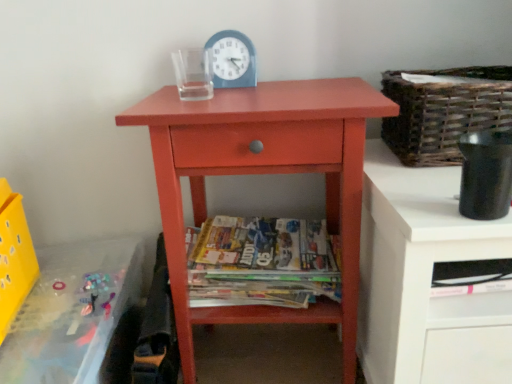
Question: Is matte wood nightstand at center oriented away from woven brown basket at upper right?

Choices:
 (A) no
 (B) yes

Answer: (A)

Question: Is matte wood nightstand at center taller than woven brown basket at upper right?

Choices:
 (A) yes
 (B) no

Answer: (A)

Question: Does matte wood nightstand at center have a greater width compared to woven brown basket at upper right?

Choices:
 (A) yes
 (B) no

Answer: (A)

Question: From the image's perspective, is matte wood nightstand at center on top of woven brown basket at upper right?

Choices:
 (A) yes
 (B) no

Answer: (B)

Question: Is matte wood nightstand at center behind woven brown basket at upper right?

Choices:
 (A) no
 (B) yes

Answer: (A)

Question: Considering the relative positions of matte wood nightstand at center and woven brown basket at upper right in the image provided, is matte wood nightstand at center in front of woven brown basket at upper right?

Choices:
 (A) no
 (B) yes

Answer: (B)

Question: Is translucent plastic changing table at lower left to the left of matte wood nightstand at center from the viewer's perspective?

Choices:
 (A) yes
 (B) no

Answer: (A)

Question: From a real-world perspective, is translucent plastic changing table at lower left physically below matte wood nightstand at center?

Choices:
 (A) no
 (B) yes

Answer: (B)

Question: Could you tell me if translucent plastic changing table at lower left is facing matte wood nightstand at center?

Choices:
 (A) no
 (B) yes

Answer: (A)

Question: Is translucent plastic changing table at lower left further to the viewer compared to matte wood nightstand at center?

Choices:
 (A) no
 (B) yes

Answer: (A)

Question: Is translucent plastic changing table at lower left outside matte wood nightstand at center?

Choices:
 (A) yes
 (B) no

Answer: (A)

Question: Does translucent plastic changing table at lower left contain matte wood nightstand at center?

Choices:
 (A) yes
 (B) no

Answer: (B)

Question: Is woven brown basket at upper right outside of printed paper magazines at center?

Choices:
 (A) no
 (B) yes

Answer: (B)